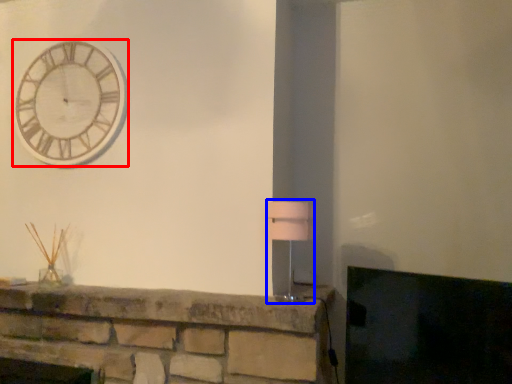
Question: Which point is further to the camera, wall clock (highlighted by a red box) or table lamp (highlighted by a blue box)?

Choices:
 (A) wall clock
 (B) table lamp

Answer: (A)